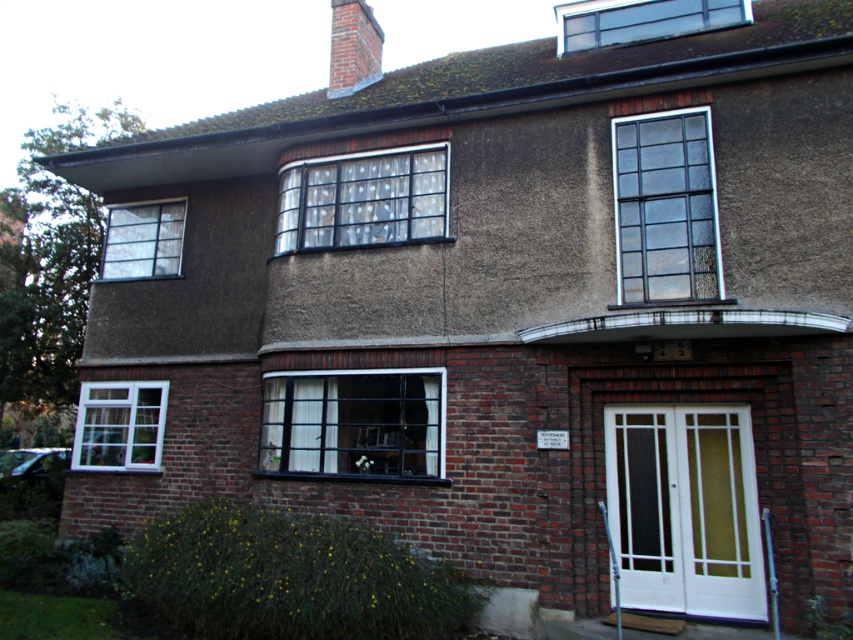
In the scene shown: You are standing outside the residential building and want to reach the white glass window at center. The ladder you have can extend up to 25 feet. Do you think the ladder will be long enough to reach the window?

The distance between the white glass window at center and the viewer is 27.37 feet, which is longer than the ladder can extend. Therefore, the ladder will not be long enough to reach the window.

You are standing at a point 8.92 meters away from the point marked at coordinates point (299,470). You want to take a photo of the bay window with grid pattern of small panes on the upper floor. Will you be able to capture the entire bay window in your camera frame if your camera has a 50mm lens? Assume the bay window is 2 meters wide and the point marked is the center of the bay window.

The point marked at coordinates point (299,470) is 8.92 meters away from you. Using the camera with a 50mm lens, the field of view at that distance would allow capturing objects up to approximately 2.5 meters wide centered at the point. Since the bay window is 2 meters wide, it will fit within the frame.